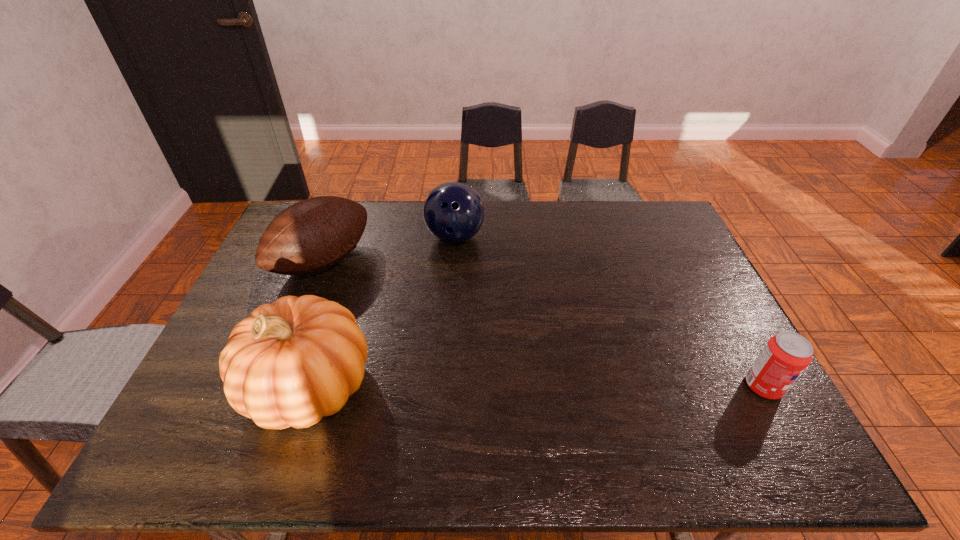
You are a GUI agent. You are given a task and a screenshot of the screen. Output one action in this format:
    pyautogui.click(x=<x>, y=<y>)
    Task: Click on the vacant space in between the rightmost object and the bowling ball
    
    Given the screenshot: What is the action you would take?
    609,312

Locate an element on the screen. The image size is (960, 540). free space between the football and the bowling ball is located at coordinates (389, 249).

This screenshot has width=960, height=540. I want to click on free area in between the tallest object and the shortest object, so click(537, 386).

Where is `free area in between the second object from right to left and the tallest object`? The height and width of the screenshot is (540, 960). free area in between the second object from right to left and the tallest object is located at coordinates (382, 312).

Locate which object ranks third in proximity to the football. Please provide its 2D coordinates. Your answer should be formatted as a tuple, i.e. [(x, y)], where the tuple contains the x and y coordinates of a point satisfying the conditions above.

[(786, 355)]

Locate an element on the screen. This screenshot has width=960, height=540. object that stands as the third closest to the third object from left to right is located at coordinates (786, 355).

The image size is (960, 540). I want to click on free region that satisfies the following two spatial constraints: 1. on the back side of the pumpkin; 2. on the right side of the bowling ball, so click(358, 237).

At what (x,y) coordinates should I click in order to perform the action: click on vacant space that satisfies the following two spatial constraints: 1. on the back side of the tallest object; 2. on the right side of the bowling ball. Please return your answer as a coordinate pair (x, y). Looking at the image, I should click on (358, 237).

The width and height of the screenshot is (960, 540). Identify the location of vacant space that satisfies the following two spatial constraints: 1. on the front side of the soda can; 2. on the surface of the football. (275, 386).

You are a GUI agent. You are given a task and a screenshot of the screen. Output one action in this format:
    pyautogui.click(x=<x>, y=<y>)
    Task: Click on the free spot that satisfies the following two spatial constraints: 1. on the front side of the football; 2. on the surface of the shortest object
    Image resolution: width=960 pixels, height=540 pixels.
    Given the screenshot: What is the action you would take?
    pyautogui.click(x=275, y=386)